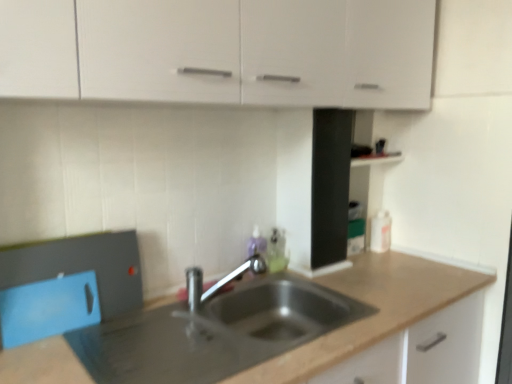
Question: Can we say white matte cabinet at upper center lies outside polished chrome tap at center?

Choices:
 (A) yes
 (B) no

Answer: (A)

Question: From the image's perspective, is white matte cabinet at upper center beneath polished chrome tap at center?

Choices:
 (A) yes
 (B) no

Answer: (B)

Question: Is white matte cabinet at upper center wider than polished chrome tap at center?

Choices:
 (A) no
 (B) yes

Answer: (B)

Question: From the image's perspective, is white matte cabinet at upper center above polished chrome tap at center?

Choices:
 (A) yes
 (B) no

Answer: (A)

Question: Does white matte cabinet at upper center appear on the right side of polished chrome tap at center?

Choices:
 (A) no
 (B) yes

Answer: (B)

Question: Does white matte cabinet at upper center have a greater height compared to polished chrome tap at center?

Choices:
 (A) no
 (B) yes

Answer: (B)

Question: Does polished chrome tap at center have a greater height compared to metallic gray countertop at center?

Choices:
 (A) no
 (B) yes

Answer: (A)

Question: Is polished chrome tap at center positioned in front of metallic gray countertop at center?

Choices:
 (A) no
 (B) yes

Answer: (A)

Question: From the image's perspective, is polished chrome tap at center above metallic gray countertop at center?

Choices:
 (A) no
 (B) yes

Answer: (B)

Question: Is polished chrome tap at center positioned beyond the bounds of metallic gray countertop at center?

Choices:
 (A) no
 (B) yes

Answer: (B)

Question: Does polished chrome tap at center have a smaller size compared to metallic gray countertop at center?

Choices:
 (A) no
 (B) yes

Answer: (B)

Question: Is polished chrome tap at center shorter than metallic gray countertop at center?

Choices:
 (A) yes
 (B) no

Answer: (A)

Question: Would you say metallic gray countertop at center is outside polished chrome tap at center?

Choices:
 (A) no
 (B) yes

Answer: (B)